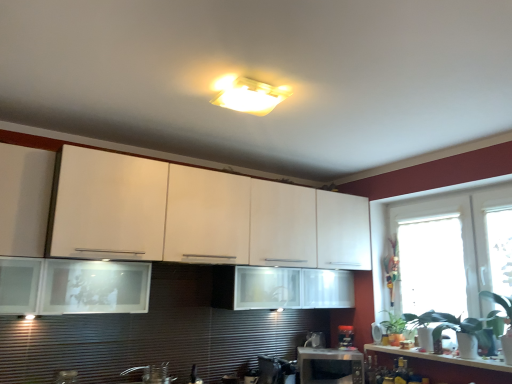
Question: Based on their positions, is transparent glass window at right, which appears as the third window when viewed from the right, located to the left or right of green leafy plant at right?

Choices:
 (A) left
 (B) right

Answer: (B)

Question: Relative to green leafy plant at right, is transparent glass window at right, the 1th window positioned from the left, in front or behind?

Choices:
 (A) behind
 (B) front

Answer: (B)

Question: Which of these objects is positioned farthest from the transparent glass window at right, the second window when ordered from right to left?

Choices:
 (A) metallic silver toaster at center, the 2th appliance when ordered from left to right
 (B) satin black coffee maker at lower center, placed as the 3th appliance when sorted from right to left
 (C) white glossy countertop at lower right
 (D) brushed metal faucet at lower center
 (E) black plastic microwave at lower center

Answer: (D)

Question: Estimate the real-world distances between objects in this image. Which object is farther from the green leafy plant at right?

Choices:
 (A) black plastic toaster at lower center, which is counted as the third appliance, starting from the left
 (B) metallic silver toaster at center, the 2th appliance when ordered from left to right
 (C) transparent glass window at right, the 1th window positioned from the left
 (D) transparent glass window at right, which ranks as the 2th window in left-to-right order
 (E) white matte cabinet at center

Answer: (E)